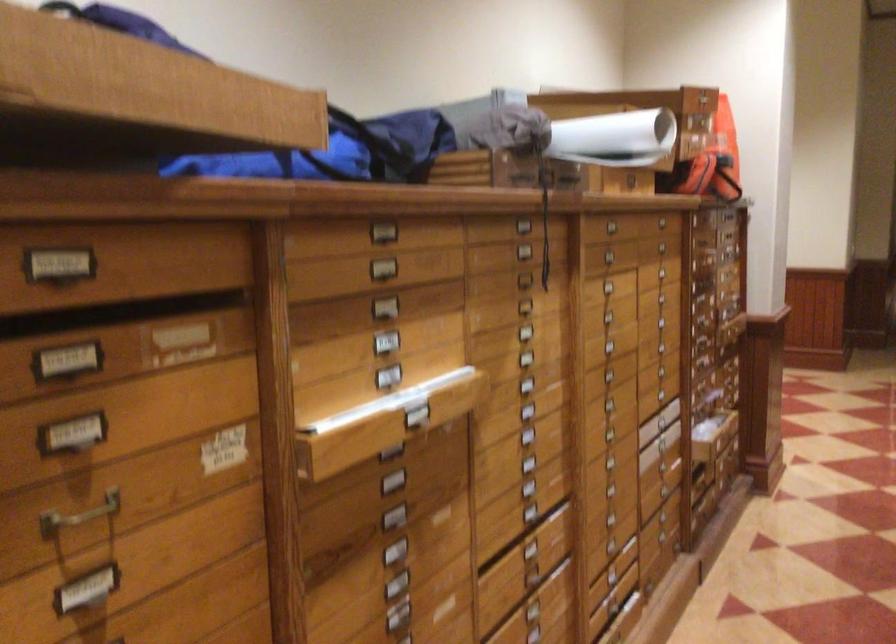
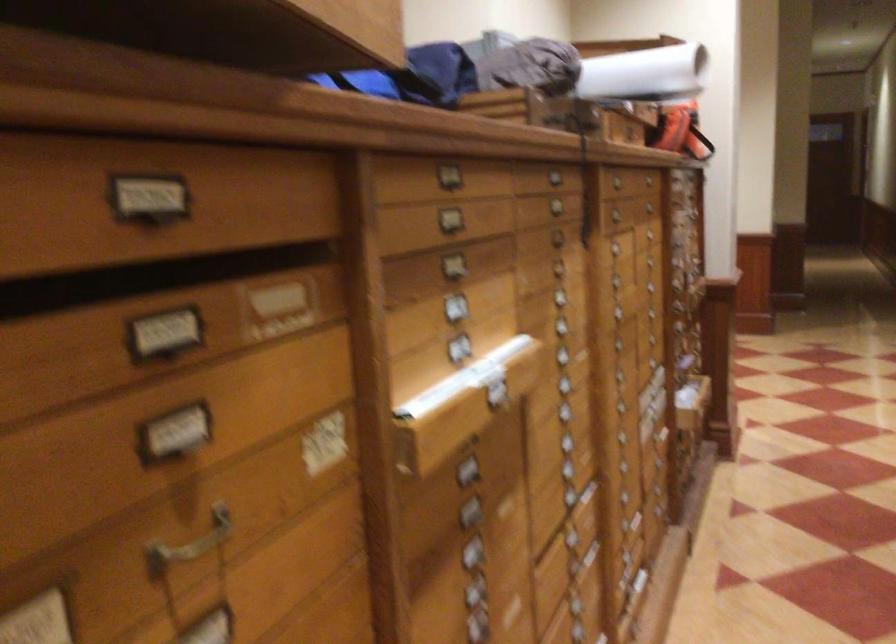
Which direction would the cameraman need to move to produce the second image?

The movement direction of the cameraman is left, forward.